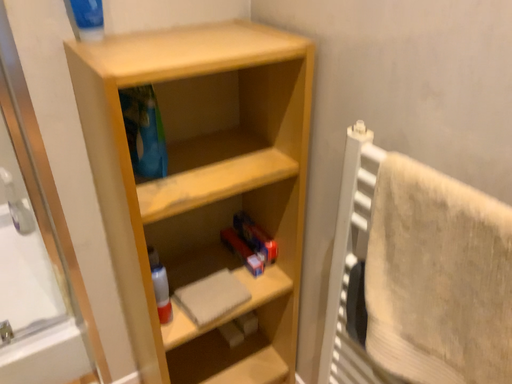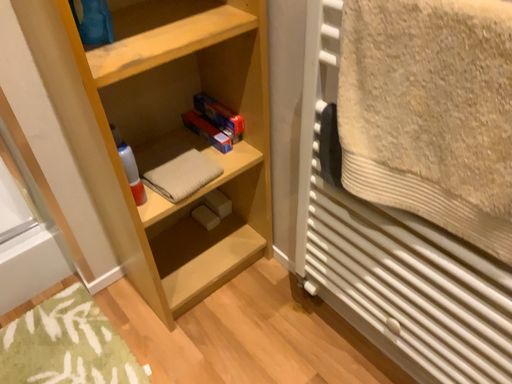
Question: Which way did the camera rotate in the video?

Choices:
 (A) rotated left
 (B) rotated right

Answer: (B)